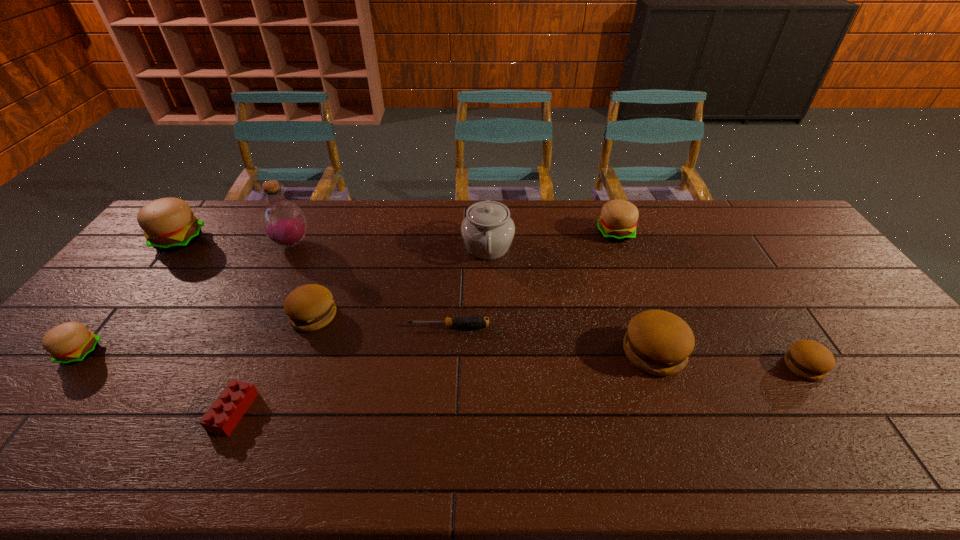
Image resolution: width=960 pixels, height=540 pixels. In order to click on vacant space located 0.070m on the front of the smallest beige hamburger in this screenshot , I will do `click(48, 392)`.

Identify the location of vacant space situated on the front of the rightmost hamburger. The height and width of the screenshot is (540, 960). (828, 404).

Where is `free space located on the front of the red Lego`? free space located on the front of the red Lego is located at coordinates (210, 463).

Find the location of a particular element. This screenshot has width=960, height=540. free spot located 0.240m on the left of the screwdriver is located at coordinates pos(321,326).

The image size is (960, 540). Identify the location of bottle present at the far edge. (283, 222).

At what (x,y) coordinates should I click in order to perform the action: click on chinaware that is at the far edge. Please return your answer as a coordinate pair (x, y). Looking at the image, I should click on (487, 230).

The image size is (960, 540). Identify the location of object located at the near edge. (226, 411).

I want to click on object present at the far left corner, so click(169, 224).

Locate an element on the screen. free space at the far edge of the desktop is located at coordinates (683, 226).

Locate an element on the screen. Image resolution: width=960 pixels, height=540 pixels. free region at the near edge of the desktop is located at coordinates (862, 443).